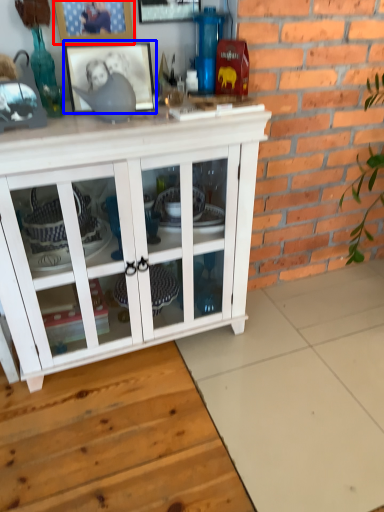
Question: Which object appears closest to the camera in this image, picture frame (highlighted by a red box) or picture frame (highlighted by a blue box)?

Choices:
 (A) picture frame
 (B) picture frame

Answer: (B)